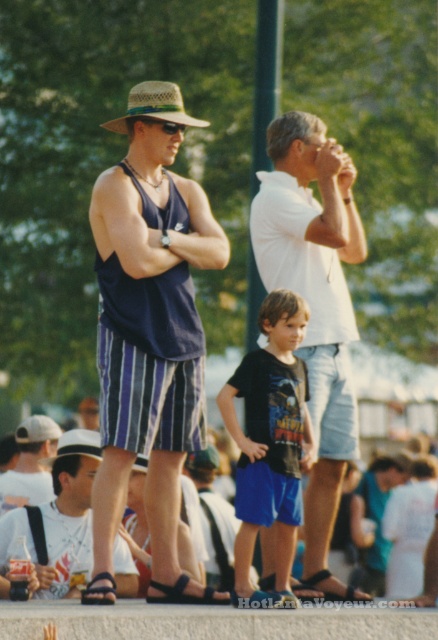
Is white cotton shirt at center smaller than black cotton shirt at center?

No, white cotton shirt at center is not smaller than black cotton shirt at center.

Is point (332, 346) closer to camera compared to point (300, 314)?

That is False.

Locate an element on the screen. white cotton shirt at center is located at coordinates (314, 305).

Where is `matte blue tank top at center`? The image size is (438, 640). matte blue tank top at center is located at coordinates (149, 333).

Does point (137, 385) come closer to viewer compared to point (339, 307)?

That is True.

The image size is (438, 640). What are the coordinates of `matte blue tank top at center` in the screenshot? It's located at (149, 333).

From the picture: Does matte blue tank top at center appear on the right side of straw hat at center?

Yes, matte blue tank top at center is to the right of straw hat at center.

Is matte blue tank top at center smaller than straw hat at center?

Yes, matte blue tank top at center is smaller than straw hat at center.

Describe the element at coordinates (149, 333) in the screenshot. I see `matte blue tank top at center` at that location.

The width and height of the screenshot is (438, 640). Identify the location of matte blue tank top at center. pyautogui.click(x=149, y=333).